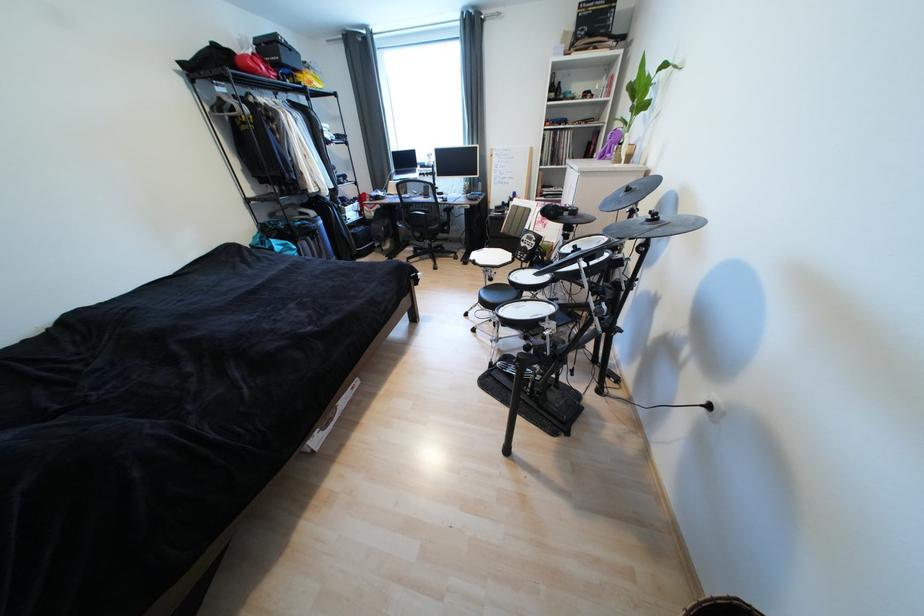
Find where to lift the black storage box. Please return your answer as a coordinate pair (x, y).

(285, 55)